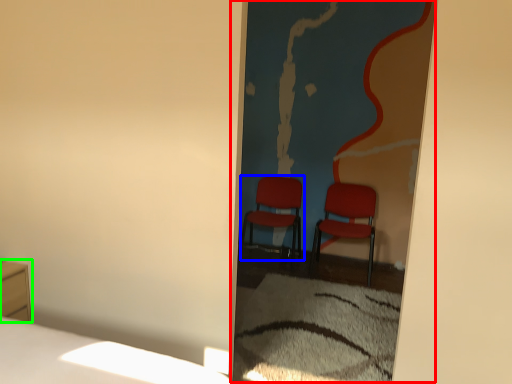
Question: Which object is positioned closest to screen door (highlighted by a red box)? Select from chair (highlighted by a blue box) and furniture (highlighted by a green box).

Choices:
 (A) chair
 (B) furniture

Answer: (A)